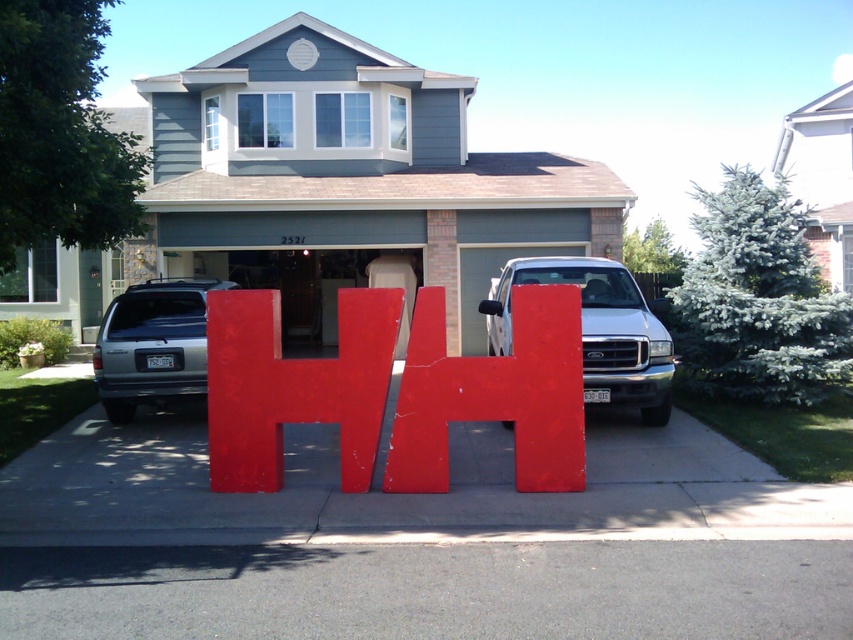
Does gray asphalt at center appear over red matte letter h at center?

No.

Between point (268, 630) and point (520, 304), which one is positioned behind?

The point (520, 304) is more distant.

Where is `gray asphalt at center`? This screenshot has width=853, height=640. gray asphalt at center is located at coordinates (432, 589).

Does gray siding garage at center come in front of smooth concrete driveway at center?

No.

Which is above, gray siding garage at center or smooth concrete driveway at center?

gray siding garage at center is above.

Is point (305, 278) behind point (831, 508)?

Yes, point (305, 278) is behind point (831, 508).

Identify the location of gray siding garage at center. This screenshot has width=853, height=640. (349, 179).

Which of these two, matte red letter h at center or silver metallic suv at center, stands taller?

With more height is silver metallic suv at center.

Does matte red letter h at center appear on the left side of silver metallic suv at center?

No, matte red letter h at center is not to the left of silver metallic suv at center.

Is point (314, 412) positioned before point (151, 401)?

Yes, it is in front of point (151, 401).

Locate an element on the screen. The width and height of the screenshot is (853, 640). matte red letter h at center is located at coordinates (294, 385).